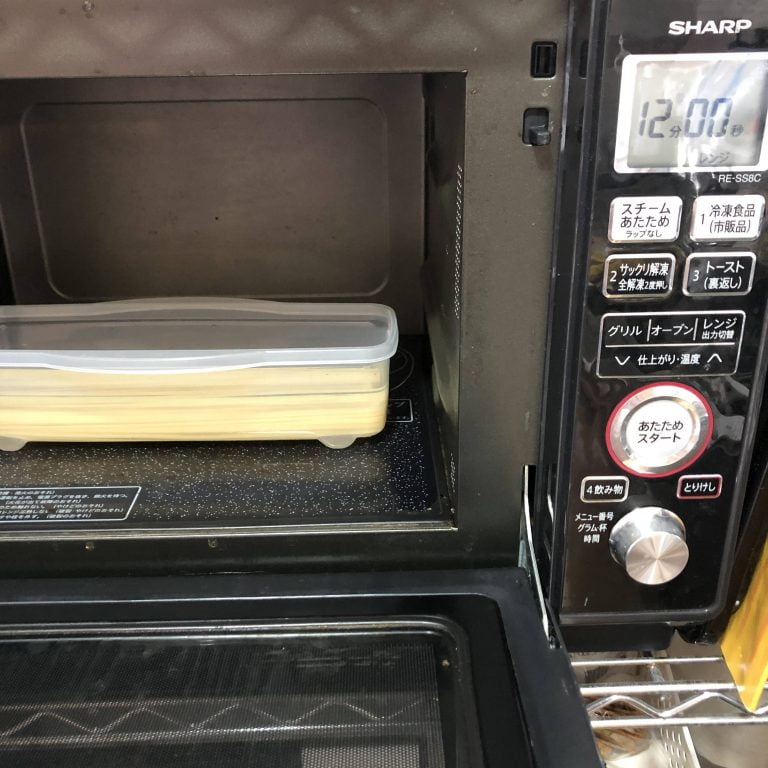
Image resolution: width=768 pixels, height=768 pixels. Identify the location of empty space in the back of an oven. (104, 202), (308, 200).